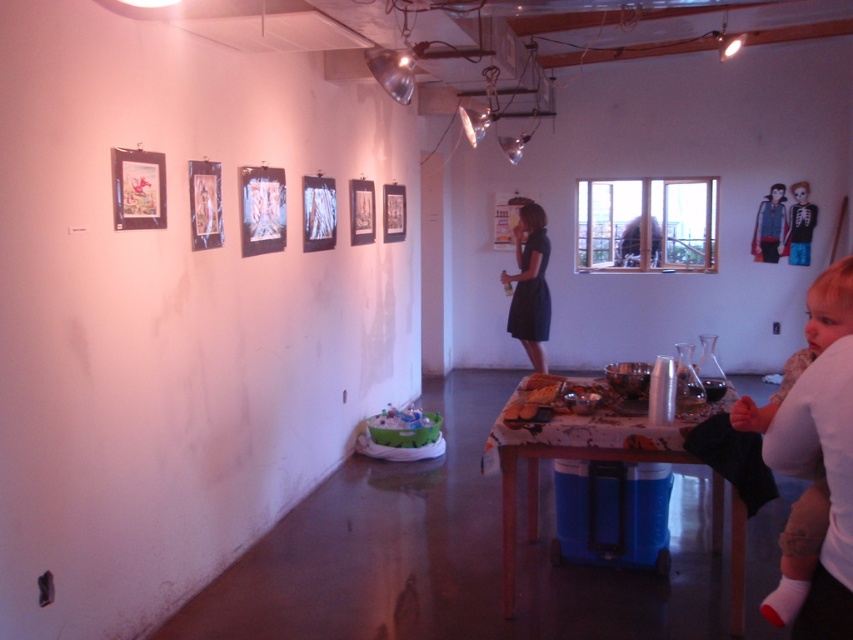
Question: Can you confirm if wooden table at lower right is bigger than blue denim jacket at upper right?

Choices:
 (A) no
 (B) yes

Answer: (B)

Question: Considering the relative positions of matte paper paintings at upper center and dark blue dress at center in the image provided, where is matte paper paintings at upper center located with respect to dark blue dress at center?

Choices:
 (A) left
 (B) right

Answer: (A)

Question: Which point appears farthest from the camera in this image?

Choices:
 (A) (279, 198)
 (B) (833, 269)

Answer: (A)

Question: Which point is farther to the camera?

Choices:
 (A) wooden table at lower right
 (B) matte paper paintings at upper center

Answer: (B)

Question: Can you confirm if wooden table at lower right is positioned below white paper doll at upper right?

Choices:
 (A) no
 (B) yes

Answer: (B)

Question: Which point is closer to the camera?

Choices:
 (A) matte paper paintings at upper center
 (B) blue denim jacket at upper right

Answer: (A)